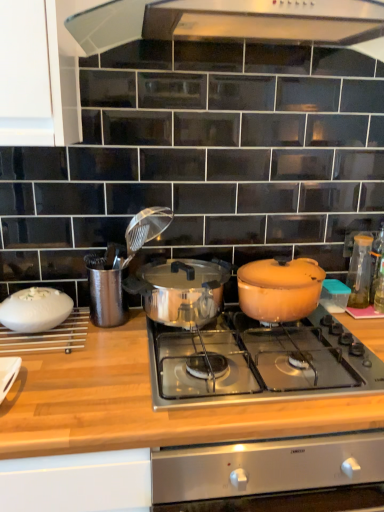
Question: From a real-world perspective, is transparent glass bottle at right, the 1th kitchen appliance positioned from the right, positioned above or below wooden at center?

Choices:
 (A) below
 (B) above

Answer: (B)

Question: From their relative heights in the image, would you say transparent glass bottle at right, which is the 1th kitchen appliance from back to front, is taller or shorter than wooden at center?

Choices:
 (A) short
 (B) tall

Answer: (A)

Question: Which of these objects is positioned closest to the polished stainless steel pot at center, arranged as the 2th pot/pan when viewed from the right?

Choices:
 (A) matte orange pot at center right, which appears as the second pot/pan when viewed from the left
 (B) shiny stainless steel cooktop at center
 (C) transparent glass bottle at right, the 1th kitchen appliance positioned from the right
 (D) wooden at center
 (E) transparent glass bottle at right

Answer: (A)

Question: Which object is the farthest from the transparent glass bottle at right?

Choices:
 (A) transparent glass bottle at right, which is the 1th kitchen appliance from back to front
 (B) polished stainless steel pot at center, which is the 1th pot/pan from left to right
 (C) matte orange pot at center right, which appears as the second pot/pan when viewed from the left
 (D) shiny stainless steel cooktop at center
 (E) wooden at center

Answer: (E)